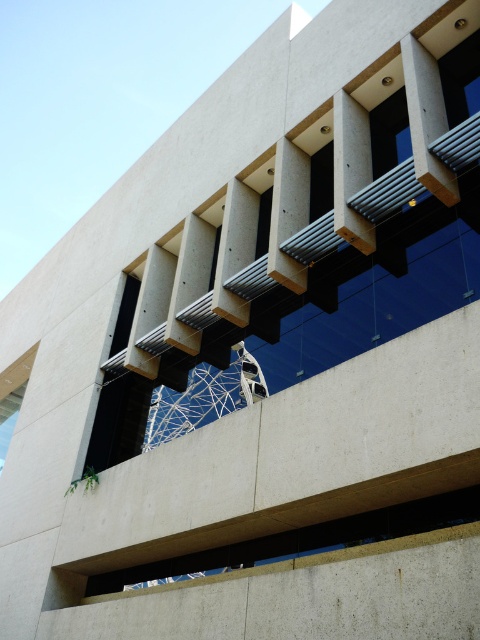
Question: Which point is closer to the camera taking this photo?

Choices:
 (A) [387, 170]
 (B) [260, 205]

Answer: (A)

Question: Does transparent glass window at upper right have a larger size compared to black glass window at upper left?

Choices:
 (A) yes
 (B) no

Answer: (B)

Question: Among these objects, which one is nearest to the camera?

Choices:
 (A) transparent glass window at upper right
 (B) black glass window at upper left

Answer: (A)

Question: Among these points, which one is nearest to the camera?

Choices:
 (A) (377, 140)
 (B) (124, 339)

Answer: (A)

Question: Is transparent glass window at upper center bigger than black glass window at upper left?

Choices:
 (A) yes
 (B) no

Answer: (B)

Question: Is transparent glass window at upper right smaller than transparent glass window at center?

Choices:
 (A) no
 (B) yes

Answer: (A)